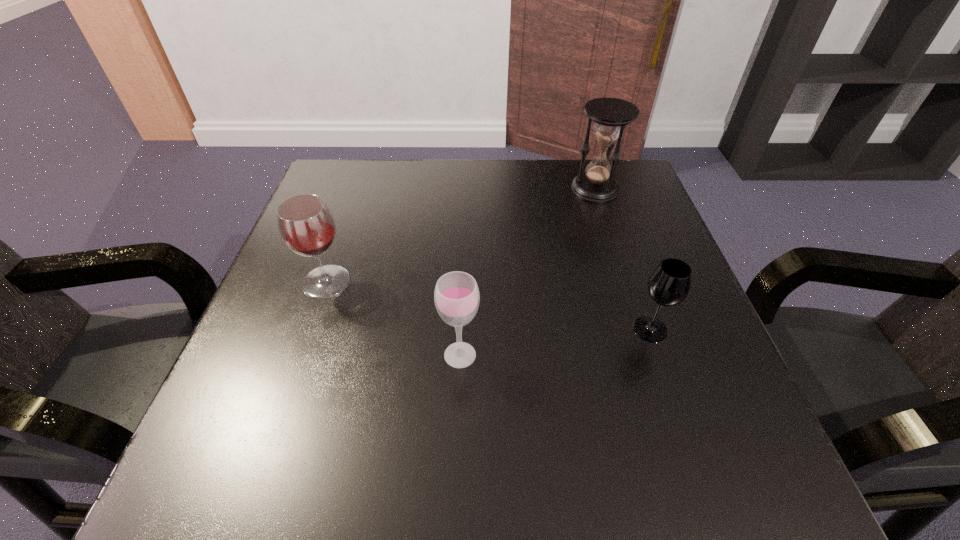
Find the location of `object that is at the left edge`. object that is at the left edge is located at coordinates (306, 225).

The height and width of the screenshot is (540, 960). Find the location of `hourglass at the right edge`. hourglass at the right edge is located at coordinates (611, 115).

At what (x,y) coordinates should I click in order to perform the action: click on wineglass at the right edge. Please return your answer as a coordinate pair (x, y). Looking at the image, I should click on (669, 285).

The width and height of the screenshot is (960, 540). I want to click on object present at the far right corner, so click(x=611, y=115).

This screenshot has width=960, height=540. In the image, there is a desktop. In order to click on vacant space at the far edge in this screenshot , I will do `click(527, 165)`.

I want to click on free location at the near edge of the desktop, so click(568, 446).

Image resolution: width=960 pixels, height=540 pixels. I want to click on vacant space at the left edge of the desktop, so click(257, 345).

Find the location of a particular element. The width and height of the screenshot is (960, 540). vacant space at the right edge of the desktop is located at coordinates (629, 336).

I want to click on vacant space at the far left corner, so click(x=348, y=170).

At what (x,y) coordinates should I click in order to perform the action: click on free space between the farthest object and the farthest wineglass. Please return your answer as a coordinate pair (x, y). Looking at the image, I should click on (461, 235).